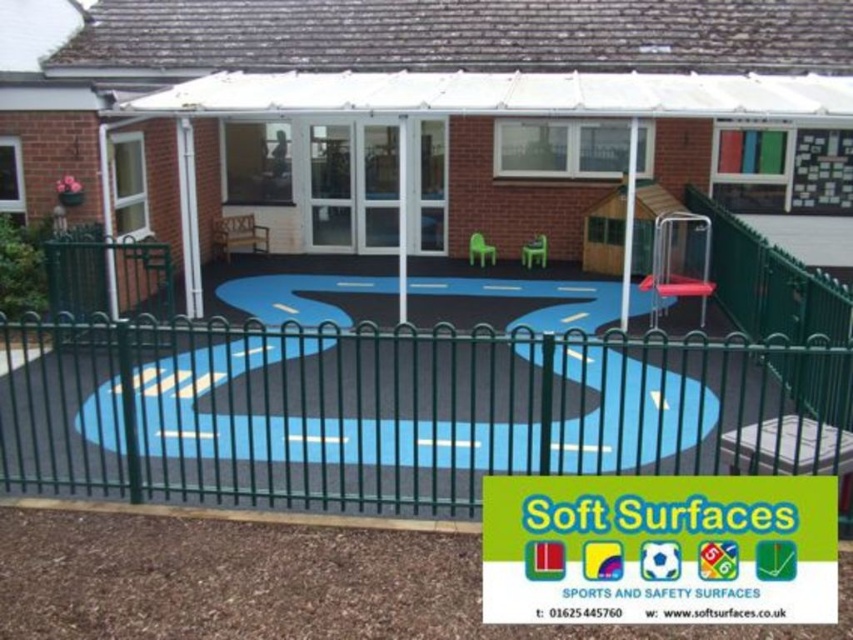
Where is `green metal fence at center`? This screenshot has height=640, width=853. green metal fence at center is located at coordinates (401, 410).

Which is in front, point (207, 397) or point (689, 272)?

Point (207, 397) is more forward.

The image size is (853, 640). What are the coordinates of `green metal fence at center` in the screenshot? It's located at (401, 410).